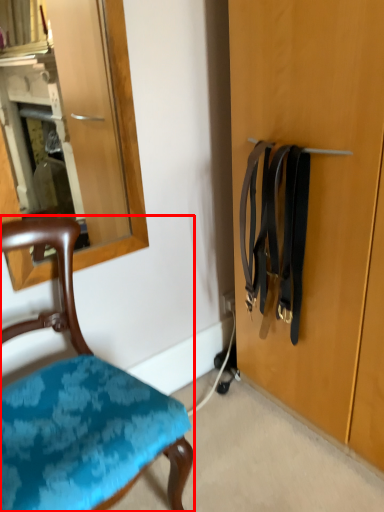
Question: From the image's perspective, considering the relative positions of chair (annotated by the red box) and suspenders in the image provided, where is chair (annotated by the red box) located with respect to the staircase?

Choices:
 (A) above
 (B) below

Answer: (B)